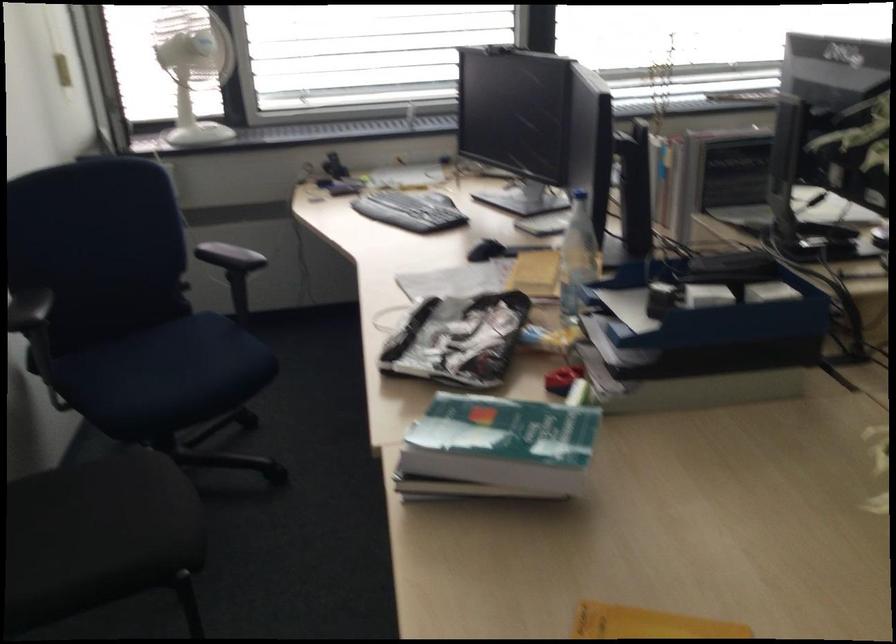
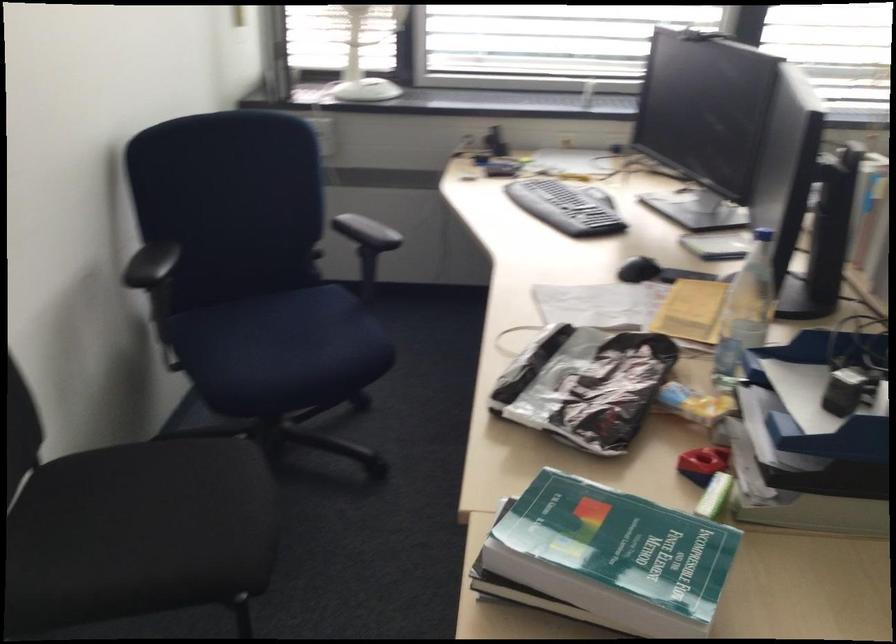
Locate, in the second image, the point that corresponds to pixel 501 440 in the first image.

(614, 556)